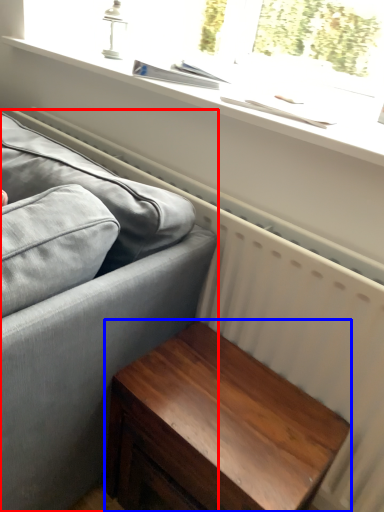
Question: Which point is closer to the camera, studio couch (highlighted by a red box) or table (highlighted by a blue box)?

Choices:
 (A) studio couch
 (B) table

Answer: (A)